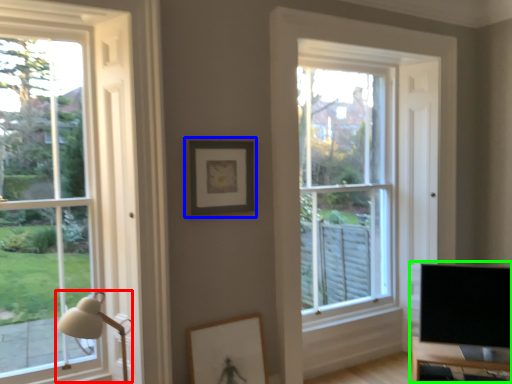
Question: Based on their relative distances, which object is farther from table lamp (highlighted by a red box)? Choose from picture frame (highlighted by a blue box) and entertainment center (highlighted by a green box).

Choices:
 (A) picture frame
 (B) entertainment center

Answer: (B)